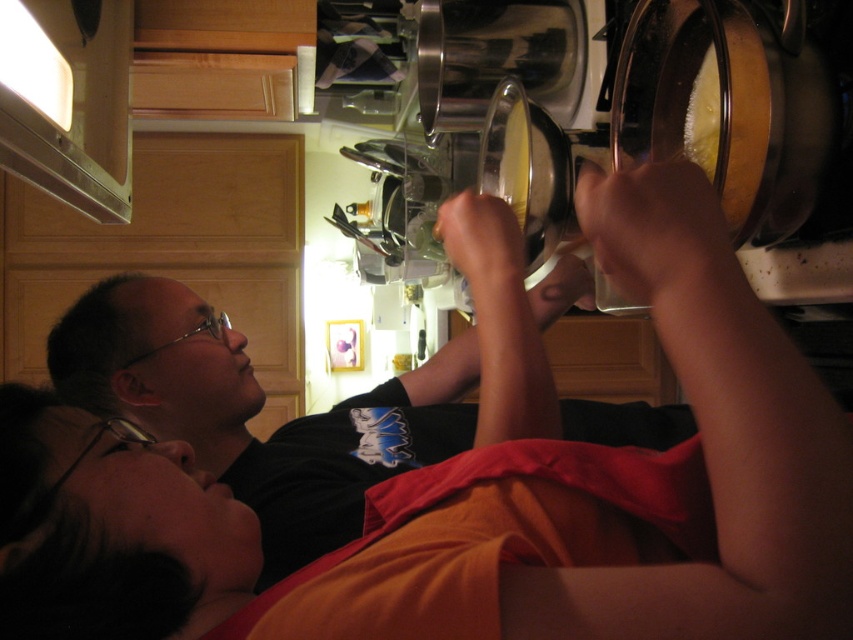
You are in a kitchen and need to reach an item placed on the metallic silver exhaust hood at upper left. Considering the height of the yellow creamy food at upper right, can you estimate if you need a stool to reach the exhaust hood?

The metallic silver exhaust hood at upper left is taller than the yellow creamy food at upper right. Since the yellow creamy food at upper right is at upper right, it might be placed at a height that is reachable without a stool, but since the exhaust hood is taller, you might need a stool to reach it.

Looking at this image, you are standing in a kitchen and see a black matte shirt at upper left and a yellow creamy food at upper right. Which object is bigger?

The black matte shirt at upper left is larger than the yellow creamy food at upper right.

You are standing in a kitchen and see the black matte shirt at upper left and the metallic silver exhaust hood at upper left. Which object is wider?

The black matte shirt at upper left is wider than the metallic silver exhaust hood at upper left.